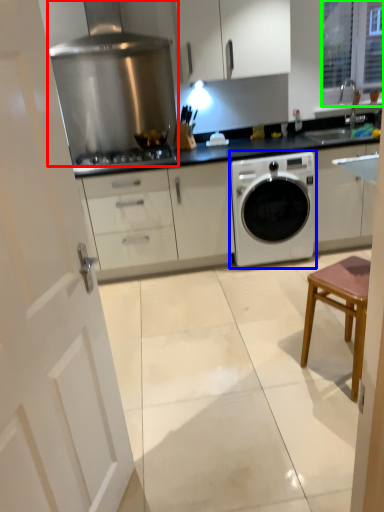
Question: Which object is the closest to the home appliance (highlighted by a red box)? Choose among these: washing machine (highlighted by a blue box) or window (highlighted by a green box).

Choices:
 (A) washing machine
 (B) window

Answer: (A)